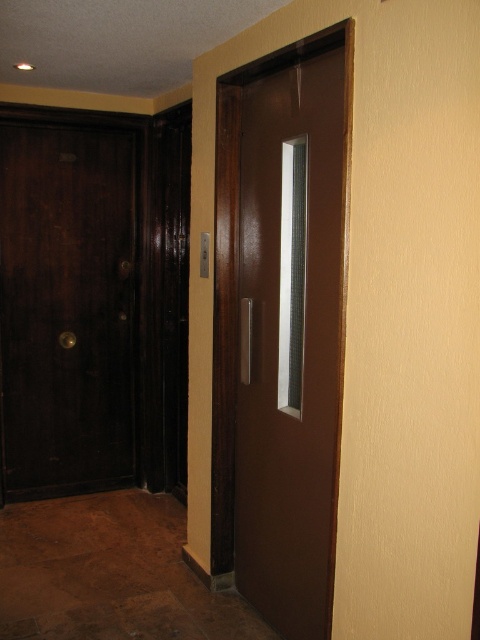
Question: Which point is farther to the camera?

Choices:
 (A) (240, 205)
 (B) (63, 216)

Answer: (B)

Question: Among these objects, which one is nearest to the camera?

Choices:
 (A) dark wood door at left
 (B) glossy brown door at center

Answer: (B)

Question: Is glossy brown door at center wider than dark wood door at left?

Choices:
 (A) yes
 (B) no

Answer: (B)

Question: Is glossy brown door at center to the right of dark wood door at left from the viewer's perspective?

Choices:
 (A) yes
 (B) no

Answer: (A)

Question: Does glossy brown door at center lie in front of dark wood door at left?

Choices:
 (A) no
 (B) yes

Answer: (B)